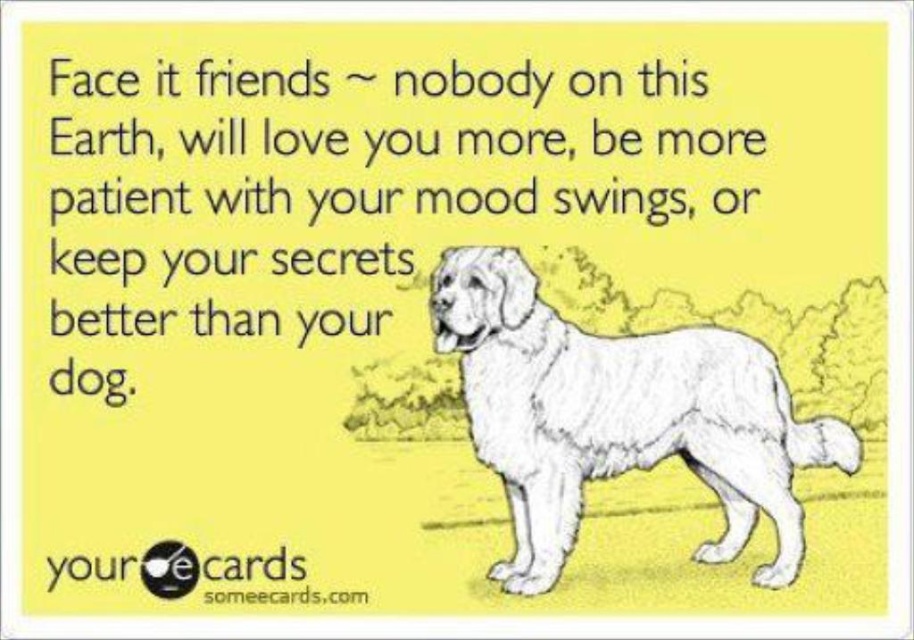
Does white fluffy dog at right appear over white paper at upper center?

No, white fluffy dog at right is not above white paper at upper center.

Does white fluffy dog at right have a greater height compared to white paper at upper center?

Yes.

Is point (683, 451) positioned after point (198, 257)?

Yes, it is.

Locate an element on the screen. Image resolution: width=914 pixels, height=640 pixels. white fluffy dog at right is located at coordinates (619, 417).